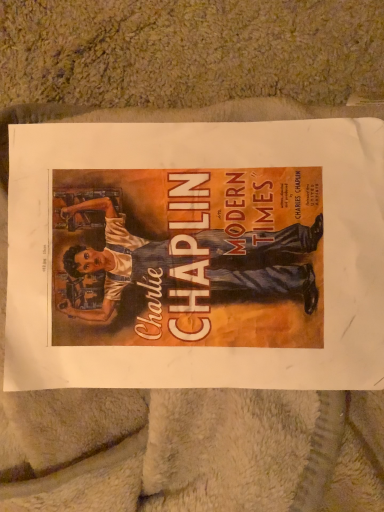
Where is `matte paper poster at center`? The height and width of the screenshot is (512, 384). matte paper poster at center is located at coordinates (196, 255).

The image size is (384, 512). What do you see at coordinates (196, 255) in the screenshot?
I see `matte paper poster at center` at bounding box center [196, 255].

Where is `matte paper poster at center`? This screenshot has height=512, width=384. matte paper poster at center is located at coordinates (196, 255).